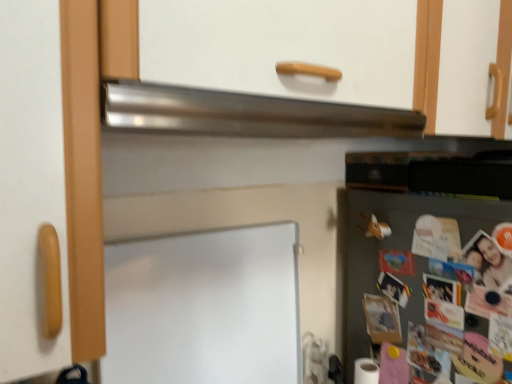
This screenshot has height=384, width=512. I want to click on empty space that is ontop of satin metallic exhaust hood at upper center (from a real-world perspective), so click(230, 106).